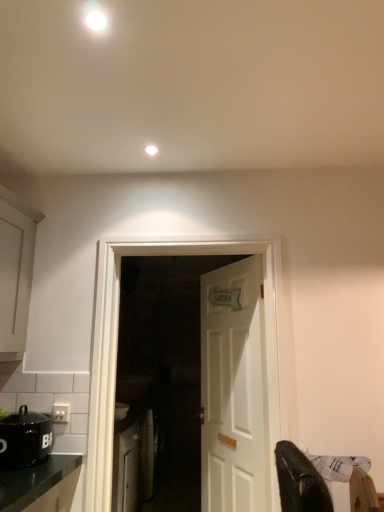
Question: Can we say black matte pot at lower left lies outside white matte cabinet at left, the 2th cabinetry from the back?

Choices:
 (A) yes
 (B) no

Answer: (A)

Question: Could you tell me if black matte pot at lower left is facing white matte cabinet at left, which is the 1th cabinetry from top to bottom?

Choices:
 (A) yes
 (B) no

Answer: (B)

Question: From a real-world perspective, is black matte pot at lower left positioned over white matte cabinet at left, marked as the 2th cabinetry in a bottom-to-top arrangement, based on gravity?

Choices:
 (A) yes
 (B) no

Answer: (B)

Question: Could white matte cabinet at left, which is the second cabinetry from right to left, be considered to be inside black matte pot at lower left?

Choices:
 (A) no
 (B) yes

Answer: (A)

Question: Does black matte pot at lower left lie in front of white matte cabinet at left, which is the second cabinetry from right to left?

Choices:
 (A) no
 (B) yes

Answer: (A)

Question: Considering their positions, is white wooden door at center, the 1th door viewed from the front, located in front of or behind white matte cabinet at left, the 2th cabinetry from the back?

Choices:
 (A) front
 (B) behind

Answer: (B)

Question: Is white wooden door at center, the 1th door viewed from the front, taller or shorter than white matte cabinet at left, the 1th cabinetry viewed from the front?

Choices:
 (A) tall
 (B) short

Answer: (A)

Question: Is white wooden door at center, the 1th door viewed from the front, wider or thinner than white matte cabinet at left, which is the second cabinetry from right to left?

Choices:
 (A) thin
 (B) wide

Answer: (A)

Question: From a real-world perspective, is white wooden door at center, arranged as the second door when viewed from the back, above or below white matte cabinet at left, the 1th cabinetry in the left-to-right sequence?

Choices:
 (A) below
 (B) above

Answer: (A)

Question: Based on their positions, is white plastic electric outlet at lower left located to the left or right of white glossy light fixture at upper center, arranged as the first lighting when viewed from the front?

Choices:
 (A) left
 (B) right

Answer: (A)

Question: Does point (59, 421) appear closer or farther from the camera than point (100, 29)?

Choices:
 (A) closer
 (B) farther

Answer: (B)

Question: From a real-world perspective, relative to white glossy light fixture at upper center, which is counted as the 1th lighting, starting from the top, is white plastic electric outlet at lower left vertically above or below?

Choices:
 (A) above
 (B) below

Answer: (B)

Question: Is white plastic electric outlet at lower left inside or outside of white glossy light fixture at upper center, which is the 2th lighting in bottom-to-top order?

Choices:
 (A) inside
 (B) outside

Answer: (B)

Question: Relative to black matte pot at lower left, is white matte cabinet at left, which is the 1th cabinetry from top to bottom, in front or behind?

Choices:
 (A) behind
 (B) front

Answer: (B)

Question: From the image's perspective, is white matte cabinet at left, marked as the 2th cabinetry in a bottom-to-top arrangement, positioned above or below black matte pot at lower left?

Choices:
 (A) above
 (B) below

Answer: (A)